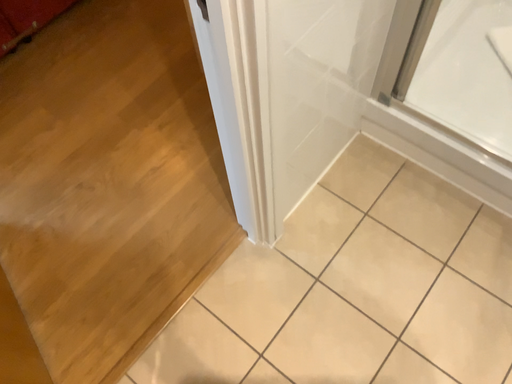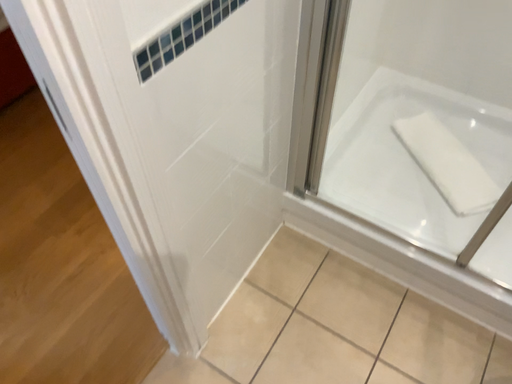
Question: Which way did the camera rotate in the video?

Choices:
 (A) rotated upward
 (B) rotated downward

Answer: (A)